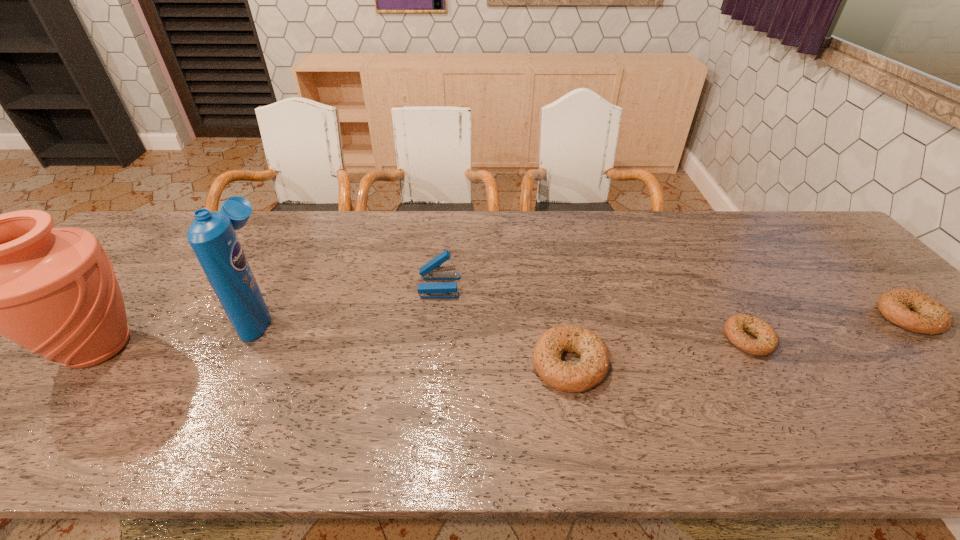
I want to click on the third object from right to left, so click(x=593, y=366).

Identify the location of the tallest bagel. (593, 366).

Locate an element on the screen. This screenshot has width=960, height=540. the second object from right to left is located at coordinates (767, 341).

You are a GUI agent. You are given a task and a screenshot of the screen. Output one action in this format:
    pyautogui.click(x=<x>, y=<y>)
    Task: Click on the second bagel from right to left
    The width and height of the screenshot is (960, 540).
    Given the screenshot: What is the action you would take?
    pyautogui.click(x=767, y=341)

What are the coordinates of `vase` in the screenshot? It's located at (53, 291).

Locate an element on the screen. The image size is (960, 540). shampoo is located at coordinates (212, 236).

The width and height of the screenshot is (960, 540). In order to click on the third tallest object in this screenshot , I will do (x=432, y=270).

Locate an element on the screen. stapler is located at coordinates (432, 270).

Locate an element on the screen. The height and width of the screenshot is (540, 960). vacant region located on the back of the fourth object from left to right is located at coordinates (550, 258).

The image size is (960, 540). Identify the location of free location located on the right of the shortest object. (858, 339).